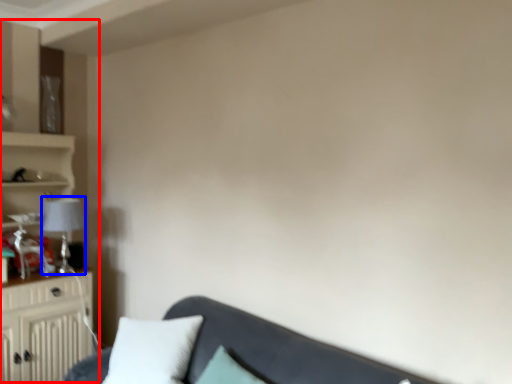
Question: Which of the following is the farthest to the observer, entertainment center (highlighted by a red box) or lamp (highlighted by a blue box)?

Choices:
 (A) entertainment center
 (B) lamp

Answer: (B)